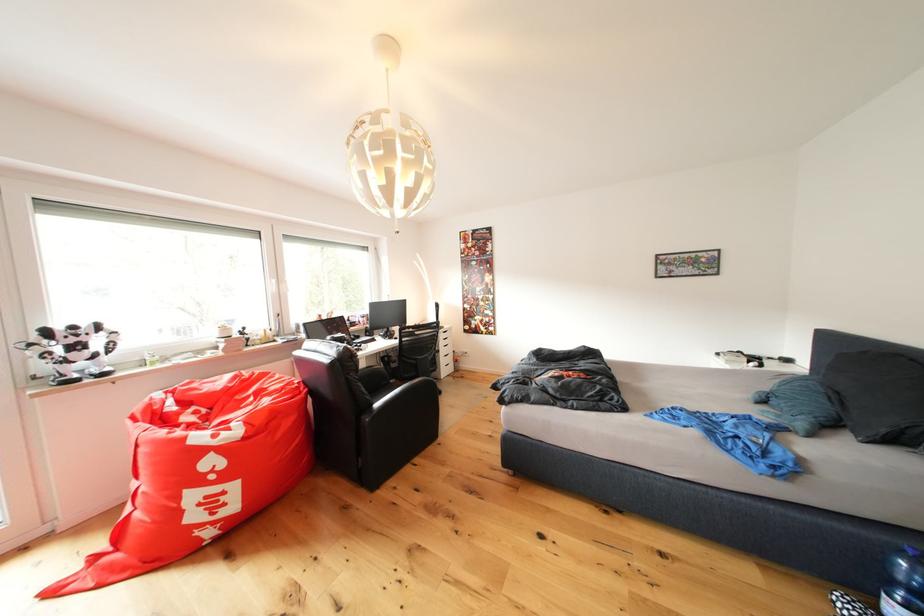
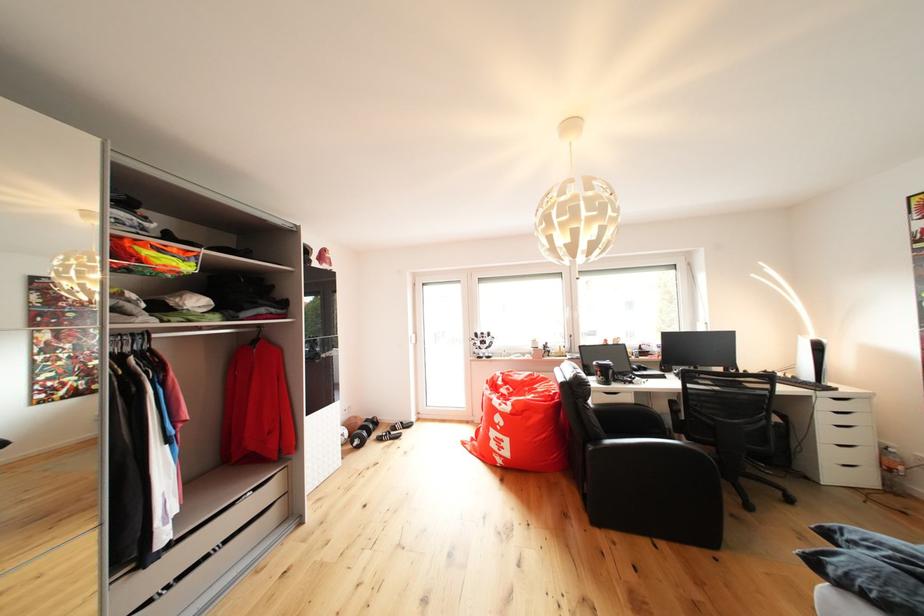
Where in the second image is the point corresponding to [455,341] from the first image?

(850, 411)